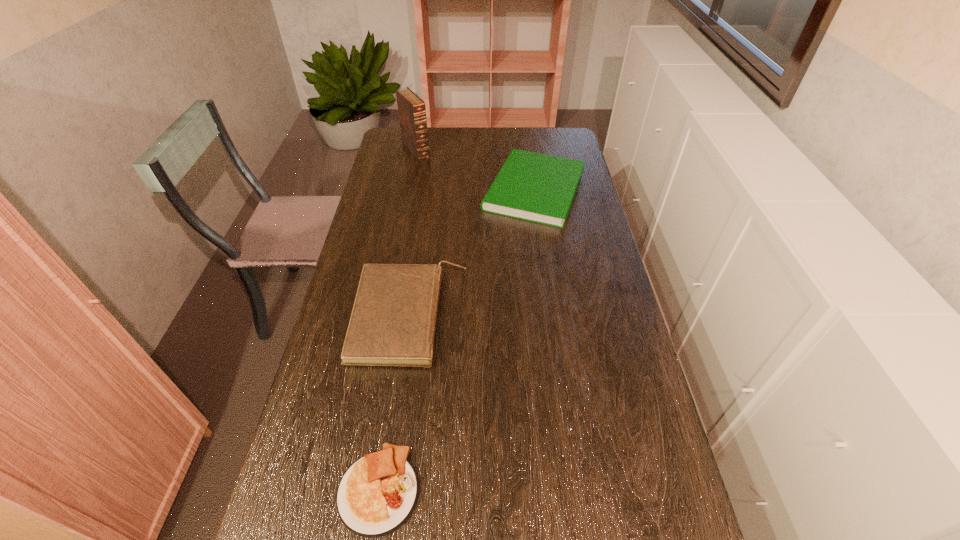
The width and height of the screenshot is (960, 540). What are the coordinates of `free space at the far right corner of the desktop` in the screenshot? It's located at (557, 136).

At what (x,y) coordinates should I click in order to perform the action: click on free point between the third tallest object and the Bible. Please return your answer as a coordinate pair (x, y). Looking at the image, I should click on (475, 170).

Identify the location of free space that is in between the second nearest object and the tallest object. (413, 233).

You are a GUI agent. You are given a task and a screenshot of the screen. Output one action in this format:
    pyautogui.click(x=<x>, y=<y>)
    Task: Click on the vacant space in between the omelet and the rightmost object
    The height and width of the screenshot is (540, 960).
    Given the screenshot: What is the action you would take?
    pyautogui.click(x=457, y=340)

Identify the location of empty space between the tallest object and the shorter paperback book. (475, 170).

The width and height of the screenshot is (960, 540). I want to click on free space between the tallest object and the taller paperback book, so click(x=413, y=233).

Where is `free space between the shorter paperback book and the tallest object`? This screenshot has height=540, width=960. free space between the shorter paperback book and the tallest object is located at coordinates (475, 170).

Choose which object is the third nearest neighbor to the tallest object. Please provide its 2D coordinates. Your answer should be formatted as a tuple, i.e. [(x, y)], where the tuple contains the x and y coordinates of a point satisfying the conditions above.

[(377, 494)]

Image resolution: width=960 pixels, height=540 pixels. I want to click on object that stands as the third closest to the third farthest object, so click(x=412, y=113).

Find the location of a particular element. The height and width of the screenshot is (540, 960). free location that satisfies the following two spatial constraints: 1. on the front side of the tallest object; 2. on the left side of the right paperback book is located at coordinates (408, 190).